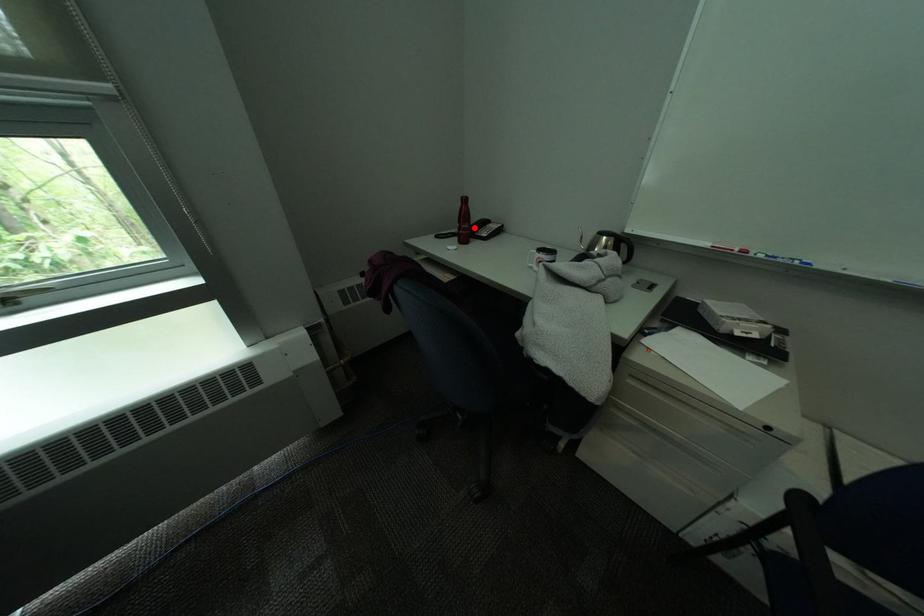
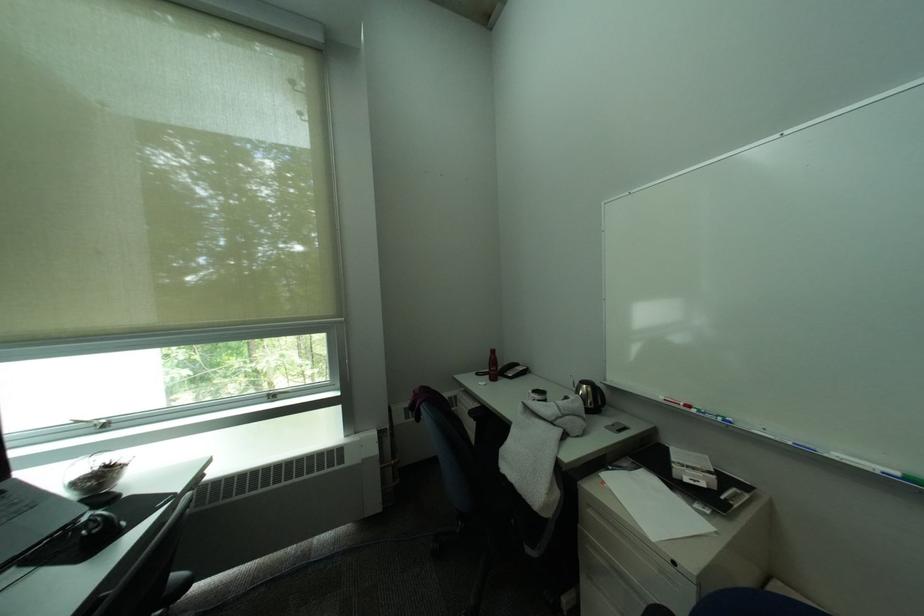
Question: A red point is marked in image1. In image2, is the corresponding 3D point closer to the camera or farther? Reply with the corresponding letter.

Choices:
 (A) The corresponding 3D point is closer.
 (B) The corresponding 3D point is farther.

Answer: (B)